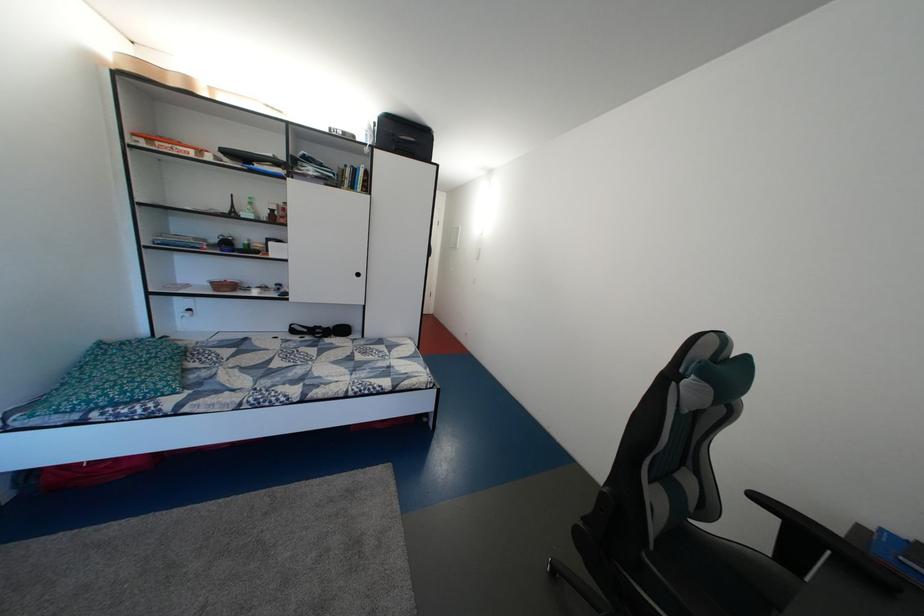
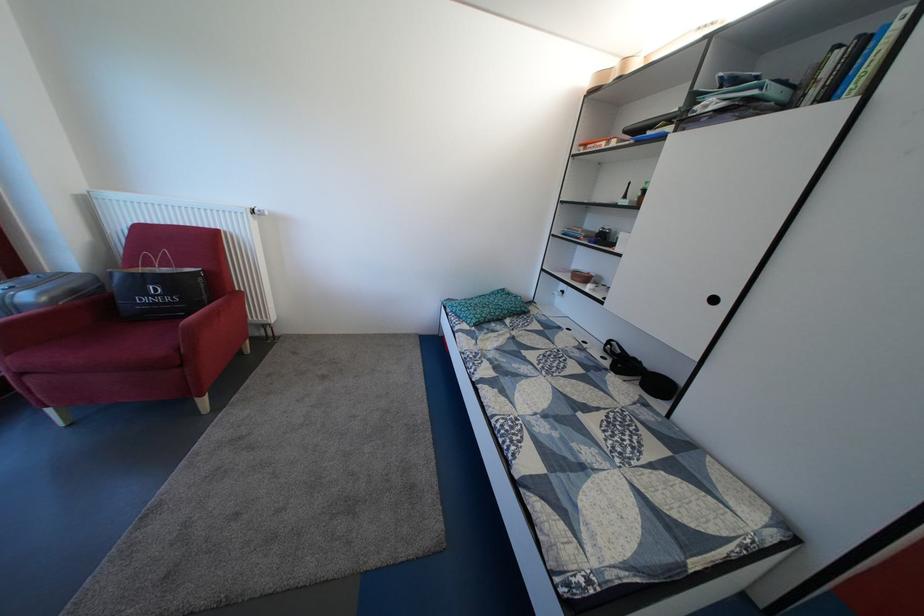
Locate, in the second image, the point that corresponds to (x=160, y=376) in the first image.

(494, 314)